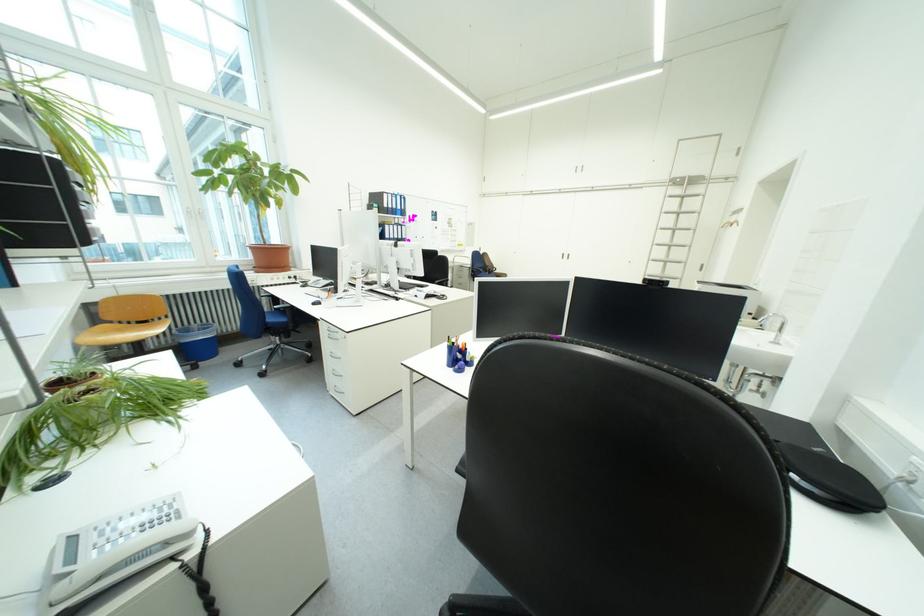
At what (x,y) coordinates should I click in order to perform the action: click on blue chair armrest. Please return your answer as a coordinate pair (x, y). Looking at the image, I should click on (295, 315).